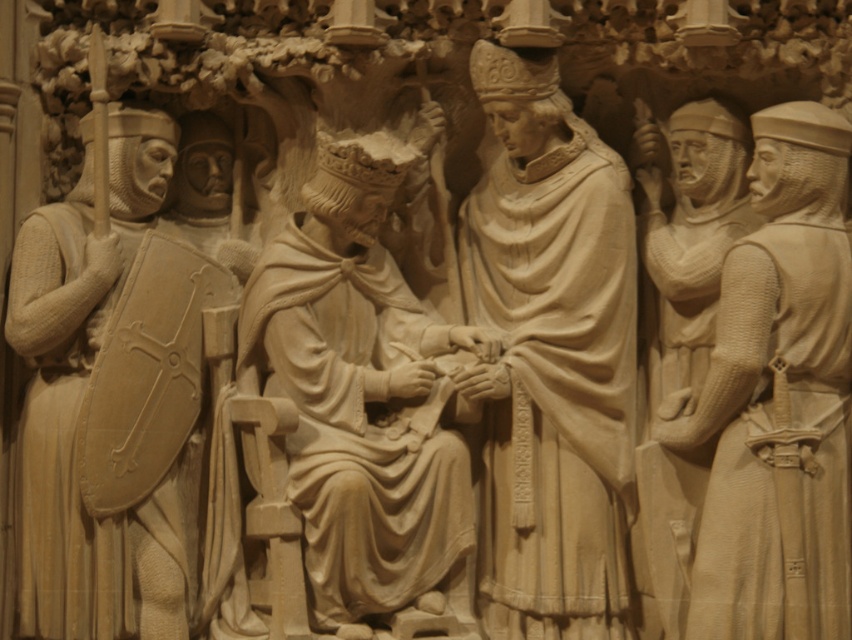
Does beige stone robe at center have a greater width compared to beige stone soldiers at right?

In fact, beige stone robe at center might be narrower than beige stone soldiers at right.

Which is in front, point (606, 568) or point (839, 634)?

Point (839, 634)

The image size is (852, 640). What are the coordinates of `beige stone robe at center` in the screenshot? It's located at (550, 356).

Can you confirm if beige stone king at center is shorter than beige stone soldiers at right?

Yes, beige stone king at center is shorter than beige stone soldiers at right.

Can you confirm if beige stone king at center is bigger than beige stone soldiers at right?

Yes, beige stone king at center is bigger than beige stone soldiers at right.

This screenshot has height=640, width=852. I want to click on beige stone king at center, so click(358, 392).

You are a GUI agent. You are given a task and a screenshot of the screen. Output one action in this format:
    pyautogui.click(x=<x>, y=<y>)
    Task: Click on the beige stone king at center
    Image resolution: width=852 pixels, height=640 pixels.
    Given the screenshot: What is the action you would take?
    pyautogui.click(x=358, y=392)

The image size is (852, 640). What are the coordinates of `beige stone robe at center` in the screenshot? It's located at (550, 356).

Which is in front, point (527, 323) or point (12, 337)?

Positioned in front is point (12, 337).

You are a GUI agent. You are given a task and a screenshot of the screen. Output one action in this format:
    pyautogui.click(x=<x>, y=<y>)
    Task: Click on the beige stone robe at center
    
    Given the screenshot: What is the action you would take?
    pyautogui.click(x=550, y=356)